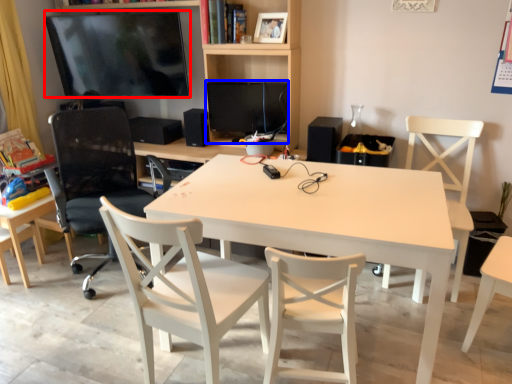
Question: Among these objects, which one is nearest to the camera, television (highlighted by a red box) or computer monitor (highlighted by a blue box)?

Choices:
 (A) television
 (B) computer monitor

Answer: (B)